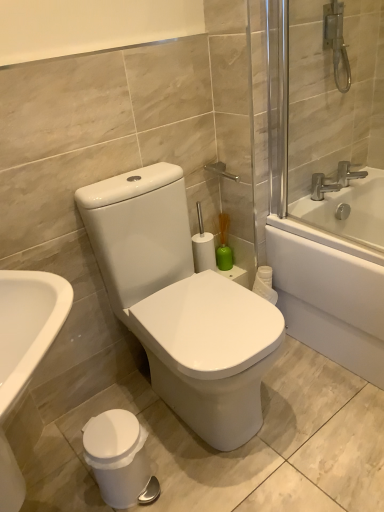
This screenshot has width=384, height=512. In order to click on vacant area located to the right-hand side of white glossy toilet at center in this screenshot , I will do `click(314, 408)`.